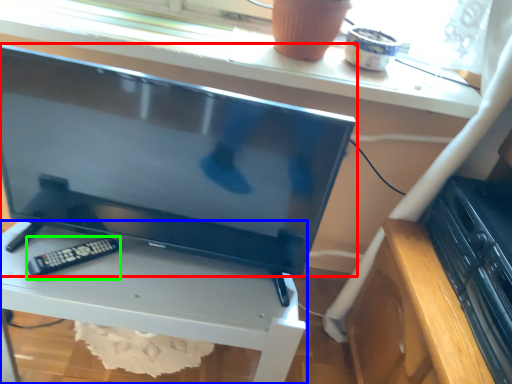
Question: Based on their relative distances, which object is nearer to television (highlighted by a red box)? Choose from furniture (highlighted by a blue box) and control (highlighted by a green box).

Choices:
 (A) furniture
 (B) control

Answer: (A)